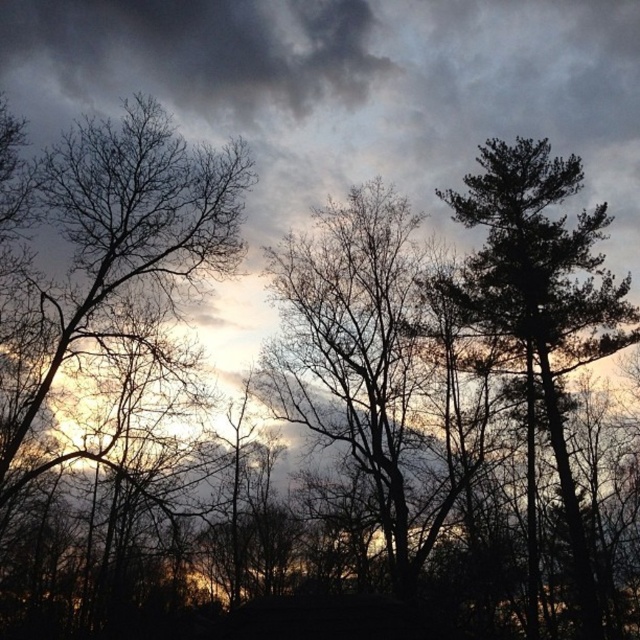
Question: Does silhouette bare tree at left come in front of silhouette bark tree at center?

Choices:
 (A) yes
 (B) no

Answer: (A)

Question: Which object appears closest to the camera in this image?

Choices:
 (A) silhouette bark tree at center
 (B) silhouette bare tree at left

Answer: (B)

Question: Which object is the farthest from the silhouette bare tree at left?

Choices:
 (A) silhouette bark tree at center
 (B) dark green textured tree at right

Answer: (B)

Question: Does silhouette bark tree at center have a greater width compared to dark green textured tree at right?

Choices:
 (A) no
 (B) yes

Answer: (A)

Question: Does silhouette bare tree at left come in front of dark green textured tree at right?

Choices:
 (A) no
 (B) yes

Answer: (B)

Question: Which point is farther to the camera?

Choices:
 (A) (369, 189)
 (B) (496, 301)

Answer: (B)